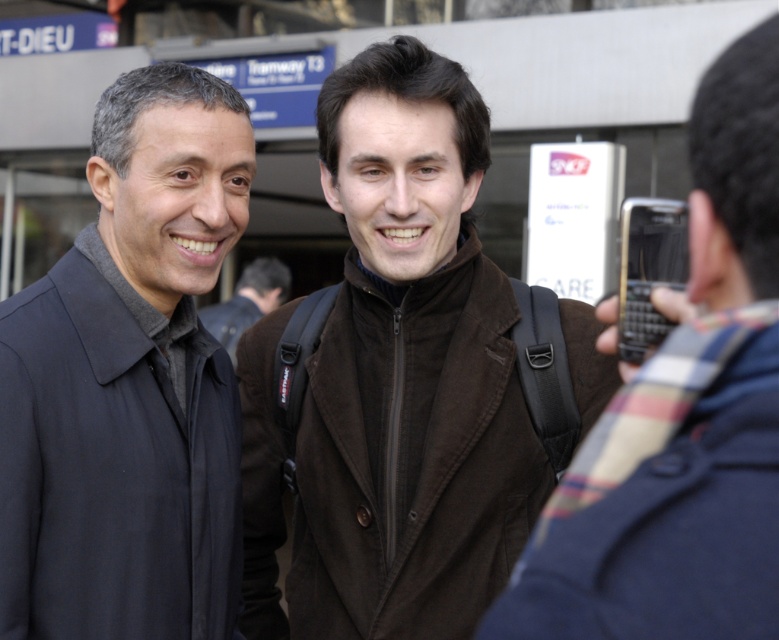
Can you confirm if brown woolen coat at center is shorter than matte black jacket at left?

No, brown woolen coat at center is not shorter than matte black jacket at left.

Between brown woolen coat at center and matte black jacket at left, which one appears on the left side from the viewer's perspective?

matte black jacket at left

Who is more distant from viewer, (381, 307) or (173, 385)?

The point (381, 307) is more distant.

Where is `brown woolen coat at center`? Image resolution: width=779 pixels, height=640 pixels. brown woolen coat at center is located at coordinates 395,380.

Is plaid scarf at upper right further to camera compared to black plastic phone at right?

No, it is not.

Based on the photo, who is positioned more to the left, plaid scarf at upper right or black plastic phone at right?

Positioned to the left is plaid scarf at upper right.

I want to click on plaid scarf at upper right, so click(x=682, y=419).

Looking at this image, does matte black jacket at left appear over plaid scarf at upper right?

Actually, matte black jacket at left is below plaid scarf at upper right.

Is matte black jacket at left further to the viewer compared to plaid scarf at upper right?

Yes, it is behind plaid scarf at upper right.

Is point (217, 84) closer to viewer compared to point (746, 621)?

No, (217, 84) is behind (746, 621).

This screenshot has height=640, width=779. I want to click on matte black jacket at left, so click(129, 384).